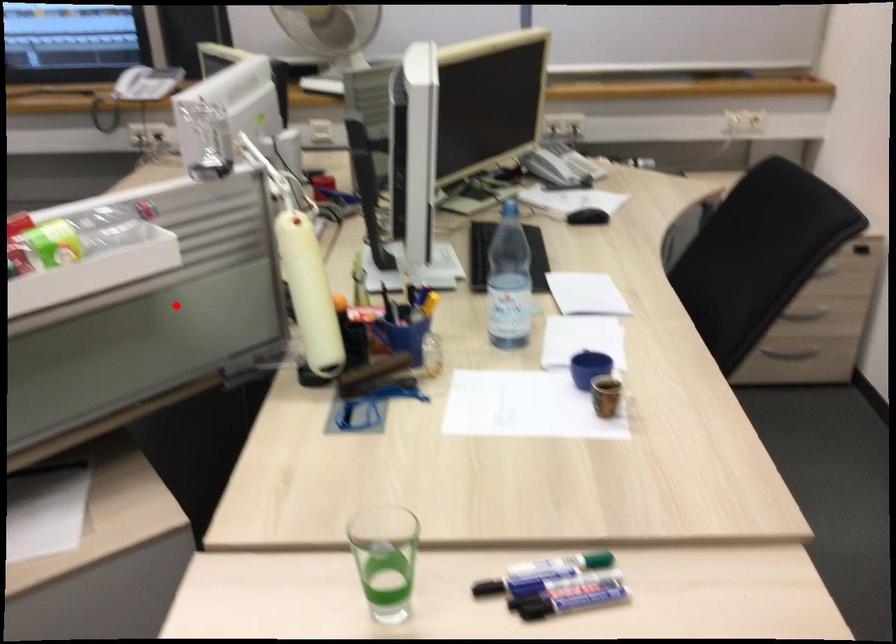
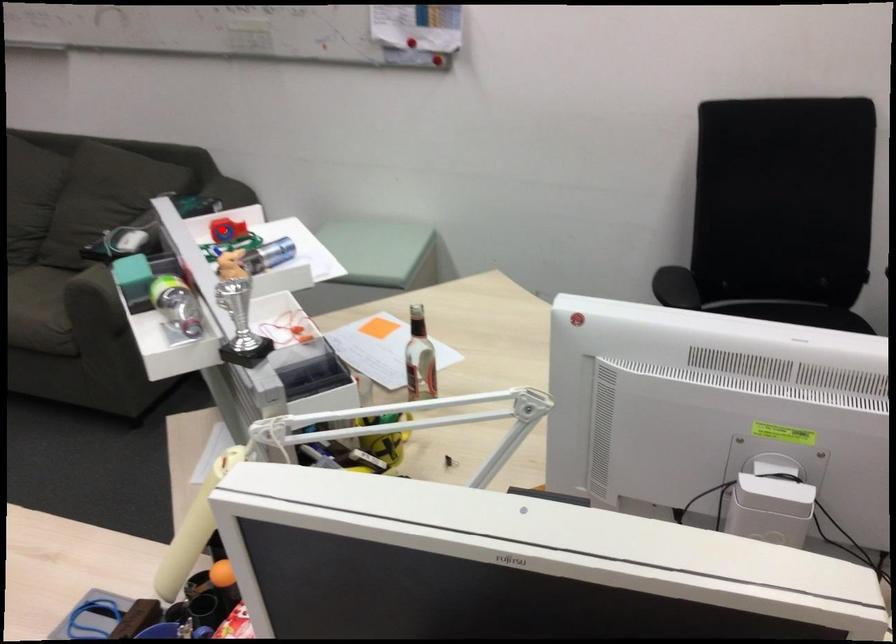
I am providing you with two images of the same scene from different viewpoints. A red point is marked on the first image and another point is marked on the second image. Does the point marked in image1 correspond to the same location as the one in image2?

No